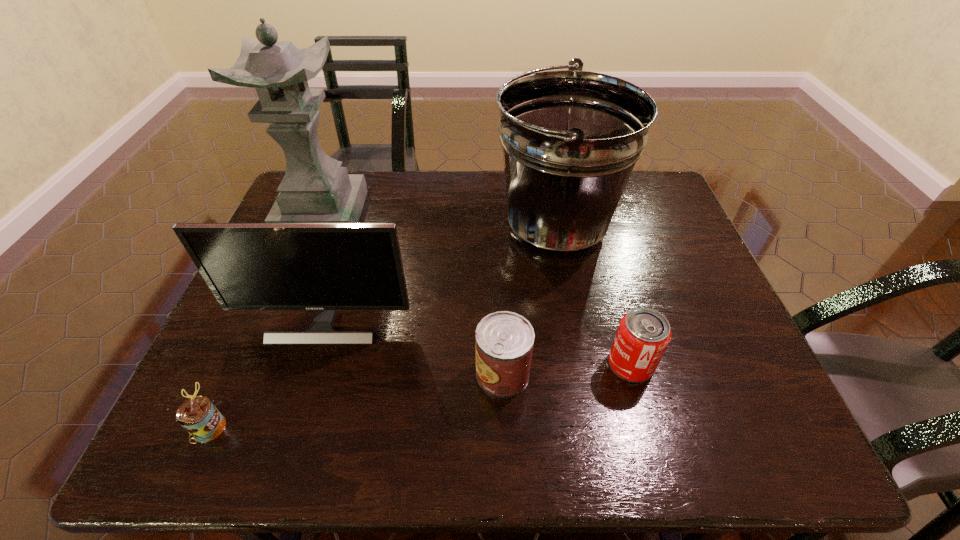
This screenshot has width=960, height=540. What are the coordinates of `free space between the shortest can and the second tallest object` in the screenshot? It's located at (382, 327).

The width and height of the screenshot is (960, 540). Identify the location of empty space between the sculpture and the fifth shortest object. (439, 220).

Where is `free point between the fifth shortest object and the tallest object`? This screenshot has height=540, width=960. free point between the fifth shortest object and the tallest object is located at coordinates (439, 220).

Locate an element on the screen. The height and width of the screenshot is (540, 960). vacant space that is in between the tallest object and the bucket is located at coordinates (439, 220).

Where is `vacant region between the bucket and the shortest can`? The height and width of the screenshot is (540, 960). vacant region between the bucket and the shortest can is located at coordinates (382, 327).

The width and height of the screenshot is (960, 540). Find the location of `vacant region between the second can from right to left and the rightmost can`. vacant region between the second can from right to left and the rightmost can is located at coordinates [x=566, y=369].

The height and width of the screenshot is (540, 960). I want to click on the third closest object to the shortest can, so click(x=315, y=189).

Find the location of `object that ranks as the second closest to the bucket`. object that ranks as the second closest to the bucket is located at coordinates (643, 335).

Identify which can is the closest to the rightmost can. Please provide its 2D coordinates. Your answer should be formatted as a tuple, i.e. [(x, y)], where the tuple contains the x and y coordinates of a point satisfying the conditions above.

[(504, 340)]

Locate an element on the screen. can identified as the closest to the second can from right to left is located at coordinates (x=643, y=335).